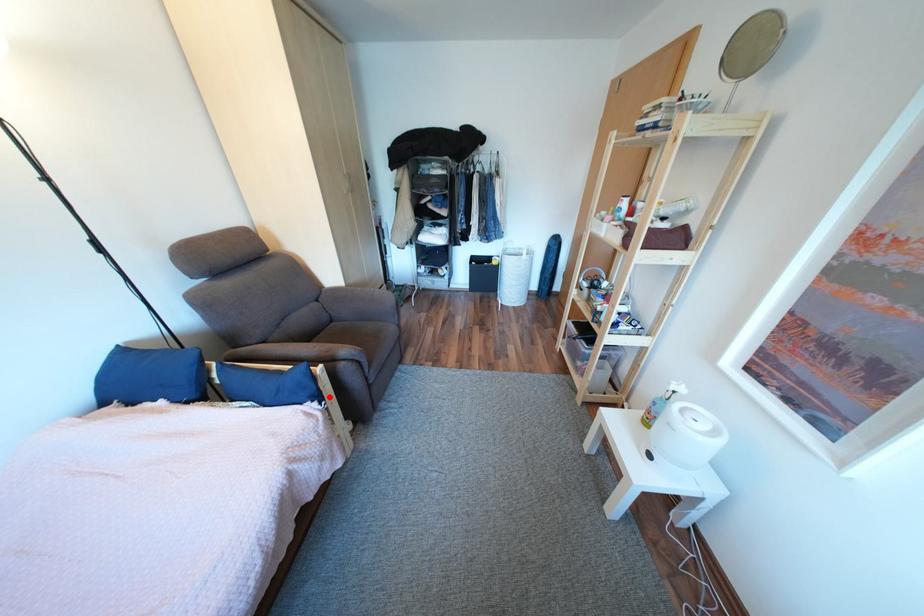
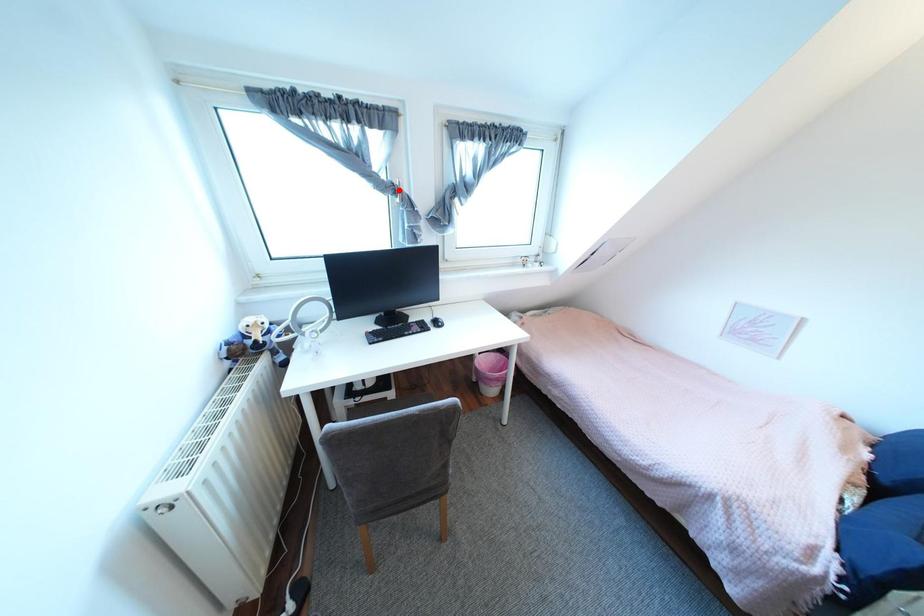
I am providing you with two images of the same scene from different viewpoints. A red point is marked on the first image and another point is marked on the second image. Do the highlighted points in image1 and image2 indicate the same real-world spot?

No